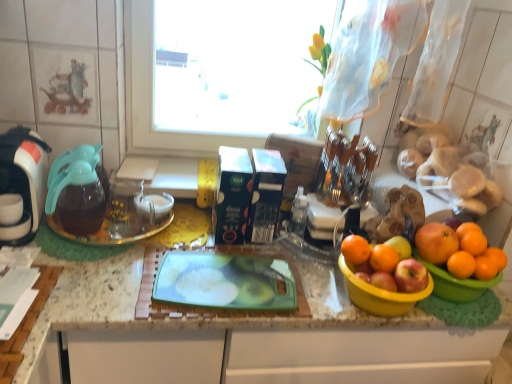
Question: Does red matte apple at right have a greater width compared to orange matte at right, which appears as the 1th orange when viewed from the right?

Choices:
 (A) no
 (B) yes

Answer: (B)

Question: Can you confirm if red matte apple at right is positioned to the right of orange matte at right, which appears as the 1th orange when viewed from the right?

Choices:
 (A) no
 (B) yes

Answer: (A)

Question: From a real-world perspective, is red matte apple at right over orange matte at right, which appears as the 1th orange when viewed from the right?

Choices:
 (A) no
 (B) yes

Answer: (A)

Question: Does red matte apple at right turn towards orange matte at right, which ranks as the 6th orange in left-to-right order?

Choices:
 (A) yes
 (B) no

Answer: (B)

Question: Is red matte apple at right to the left of orange matte at right, which ranks as the 6th orange in left-to-right order, from the viewer's perspective?

Choices:
 (A) yes
 (B) no

Answer: (A)

Question: Does red matte apple at right lie behind orange matte at right, which appears as the 1th orange when viewed from the right?

Choices:
 (A) yes
 (B) no

Answer: (B)

Question: From the image's perspective, does orange matte at right, which is the first orange from left to right, appear lower than yellow plastic bowl at right, the 1th basin when ordered from left to right?

Choices:
 (A) no
 (B) yes

Answer: (A)

Question: Can you see orange matte at right, which is the first orange from left to right, touching yellow plastic bowl at right, the 1th basin when ordered from left to right?

Choices:
 (A) no
 (B) yes

Answer: (B)

Question: Is orange matte at right, which is the first orange from left to right, shorter than yellow plastic bowl at right, the 1th basin when ordered from left to right?

Choices:
 (A) yes
 (B) no

Answer: (A)

Question: Considering the relative positions of orange matte at right, which is the first orange from left to right, and yellow plastic bowl at right, the 1th basin when ordered from left to right, in the image provided, is orange matte at right, which is the first orange from left to right, to the right of yellow plastic bowl at right, the 1th basin when ordered from left to right, from the viewer's perspective?

Choices:
 (A) yes
 (B) no

Answer: (B)

Question: Does orange matte at right, which is the first orange from left to right, have a greater width compared to yellow plastic bowl at right, which is counted as the 2th basin, starting from the right?

Choices:
 (A) yes
 (B) no

Answer: (B)

Question: Is orange matte at right, the 6th orange viewed from the right, not inside yellow plastic bowl at right, which is counted as the 2th basin, starting from the right?

Choices:
 (A) no
 (B) yes

Answer: (B)

Question: Does orange matte at right, which is the 3th orange from right to left, have a larger size compared to orange matte at right, which is the first orange from left to right?

Choices:
 (A) yes
 (B) no

Answer: (B)